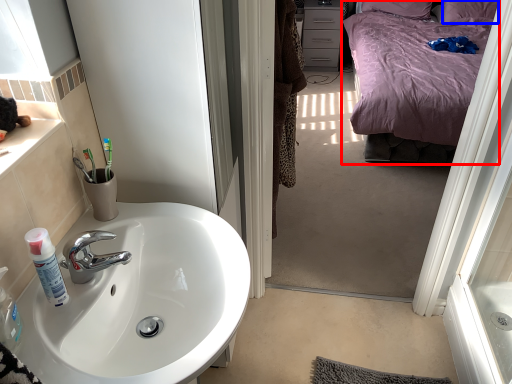
Question: Among these objects, which one is nearest to the camera, bed (highlighted by a red box) or pillow (highlighted by a blue box)?

Choices:
 (A) bed
 (B) pillow

Answer: (A)